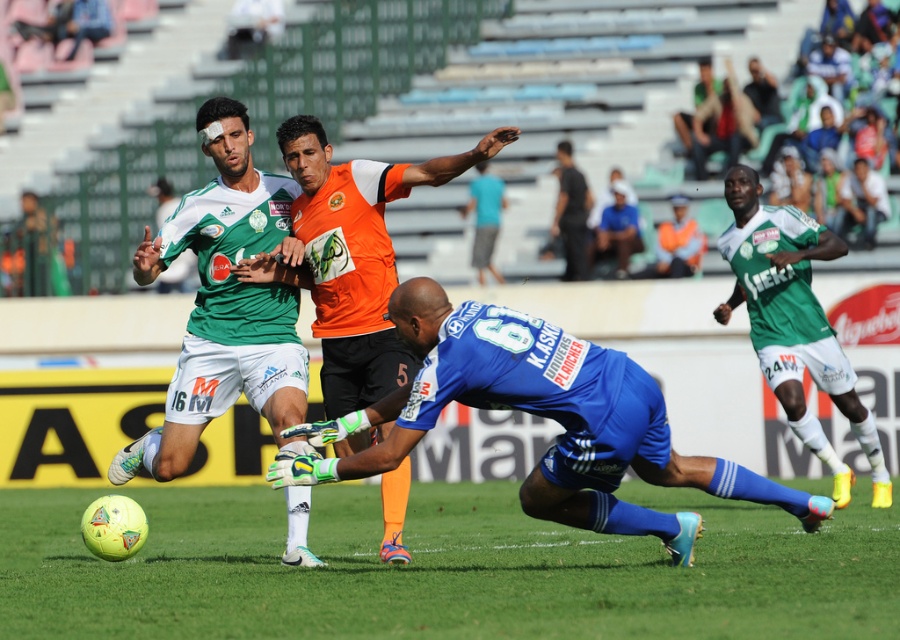
Who is positioned more to the right, orange matte jersey at center or teal fabric shirt at center?

teal fabric shirt at center is more to the right.

Locate an element on the screen. Image resolution: width=900 pixels, height=640 pixels. orange matte jersey at center is located at coordinates click(353, 257).

Is point (379, 262) positioned before point (474, 232)?

Yes, it is in front of point (474, 232).

I want to click on orange matte jersey at center, so click(x=353, y=257).

Is the position of orange matte jersey at center less distant than that of black matte shirt at center?

Yes, orange matte jersey at center is in front of black matte shirt at center.

Locate an element on the screen. This screenshot has width=900, height=640. orange matte jersey at center is located at coordinates (353, 257).

Is point (453, 157) more distant than point (586, 195)?

No.

The image size is (900, 640). I want to click on orange matte jersey at center, so click(x=353, y=257).

Does orange matte jersey at center have a smaller size compared to green jersey at center?

Yes.

In the scene shown: Who is more forward, (393, 484) or (788, 220)?

Positioned in front is point (393, 484).

Which is in front, point (389, 189) or point (748, 240)?

Positioned in front is point (389, 189).

Where is `orange matte jersey at center`? The width and height of the screenshot is (900, 640). orange matte jersey at center is located at coordinates (353, 257).